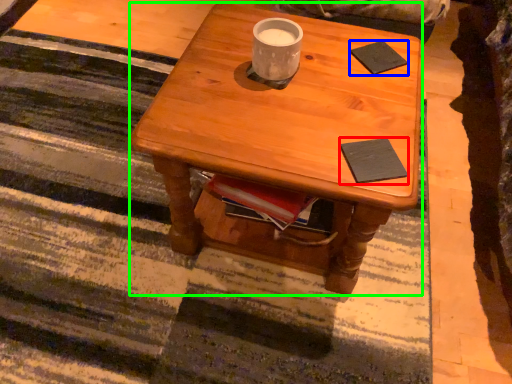
Question: Based on their relative distances, which object is nearer to pad (highlighted by a red box)? Choose from pad (highlighted by a blue box) and desk (highlighted by a green box).

Choices:
 (A) pad
 (B) desk

Answer: (B)